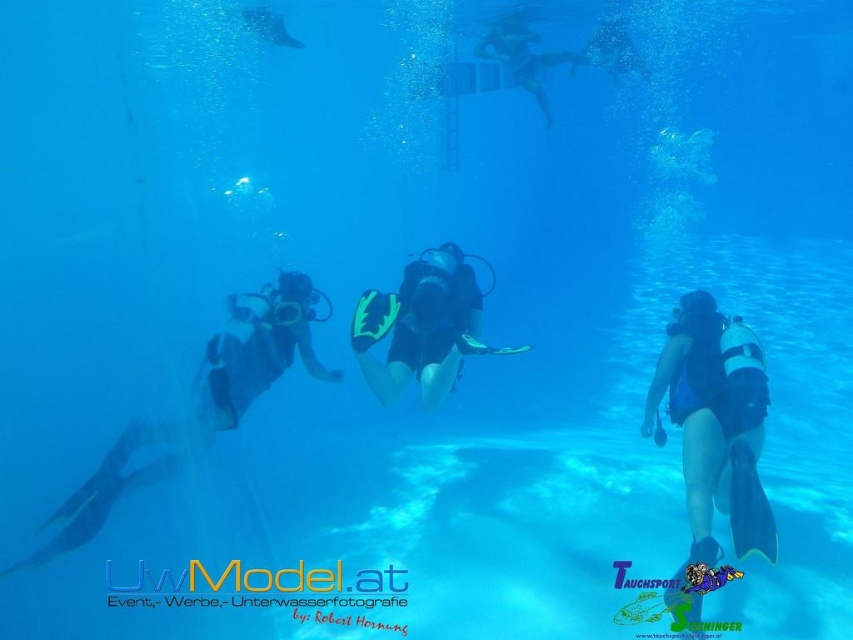
Who is lower down, black matte scuba diver at center or black matte scuba gear at center?

black matte scuba diver at center is below.

Is black matte scuba diver at center to the left of black matte scuba gear at center from the viewer's perspective?

Indeed, black matte scuba diver at center is positioned on the left side of black matte scuba gear at center.

Which is behind, point (299, 339) or point (434, 356)?

The point (299, 339) is more distant.

Identify the location of black matte scuba diver at center. (259, 352).

Looking at this image, which is more to the right, blue matte wetsuit at lower right or black matte scuba gear at center?

blue matte wetsuit at lower right

Which of these two, blue matte wetsuit at lower right or black matte scuba gear at center, stands shorter?

With less height is black matte scuba gear at center.

Where is `blue matte wetsuit at lower right`? The height and width of the screenshot is (640, 853). blue matte wetsuit at lower right is located at coordinates (717, 419).

Does point (672, 372) come behind point (155, 440)?

That is False.

What do you see at coordinates (717, 419) in the screenshot? I see `blue matte wetsuit at lower right` at bounding box center [717, 419].

Who is more forward, (711, 490) or (80, 506)?

Positioned in front is point (711, 490).

Locate an element on the screen. The image size is (853, 640). blue matte wetsuit at lower right is located at coordinates (717, 419).